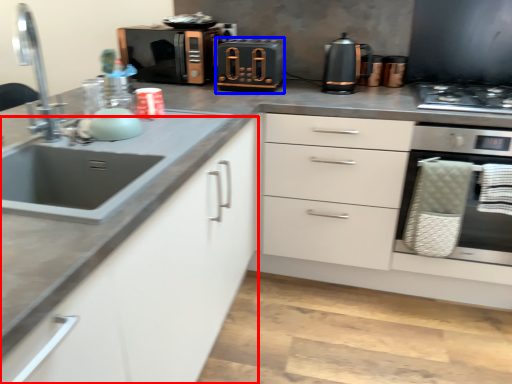
Question: Which object appears closest to the camera in this image, cabinetry (highlighted by a red box) or appliance (highlighted by a blue box)?

Choices:
 (A) cabinetry
 (B) appliance

Answer: (A)